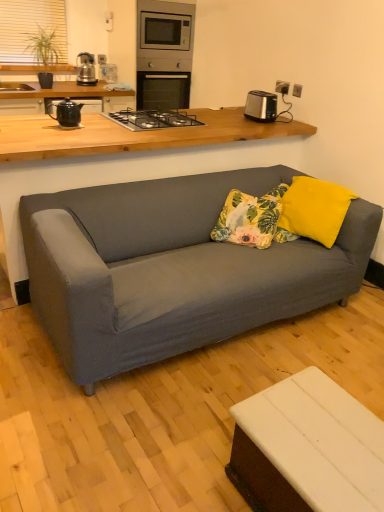
The width and height of the screenshot is (384, 512). In order to click on vacant region in front of black ceramic teapot at left in this screenshot , I will do `click(64, 130)`.